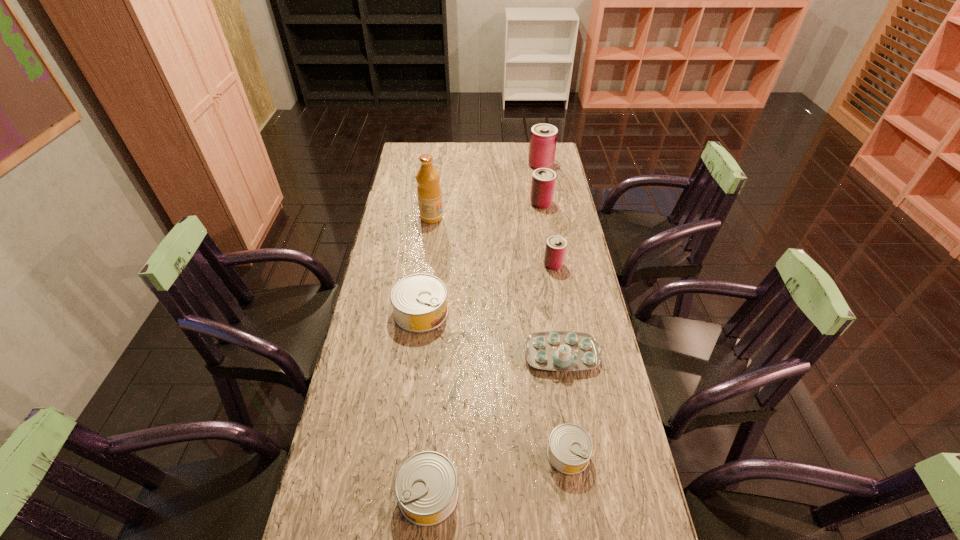
Where is `vacant region at the left edge of the desktop`? The width and height of the screenshot is (960, 540). vacant region at the left edge of the desktop is located at coordinates (421, 224).

This screenshot has height=540, width=960. Find the location of `vacant space at the right edge of the desktop`. vacant space at the right edge of the desktop is located at coordinates (561, 322).

Locate an element on the screen. vacant region between the blue chinaware and the fruit juice is located at coordinates (496, 286).

I want to click on vacant area that lies between the seventh tallest object and the tallest object, so click(430, 355).

This screenshot has width=960, height=540. What are the coordinates of `free spot between the fruit juice and the fifth nearest object` in the screenshot? It's located at (492, 241).

What are the coordinates of `vacant area that lies between the tallest object and the seventh tallest object` in the screenshot? It's located at (430, 355).

Where is `empty space between the chinaware and the nearest pink can`? Image resolution: width=960 pixels, height=540 pixels. empty space between the chinaware and the nearest pink can is located at coordinates (558, 309).

Where is `empty location between the fourth nearest can and the fruit juice`? This screenshot has width=960, height=540. empty location between the fourth nearest can and the fruit juice is located at coordinates (x=492, y=241).

The height and width of the screenshot is (540, 960). I want to click on object that is the third closest to the second tallest can, so click(x=428, y=190).

Select which object appears as the closest to the farthest silver can. Please provide its 2D coordinates. Your answer should be formatted as a tuple, i.e. [(x, y)], where the tuple contains the x and y coordinates of a point satisfying the conditions above.

[(551, 350)]